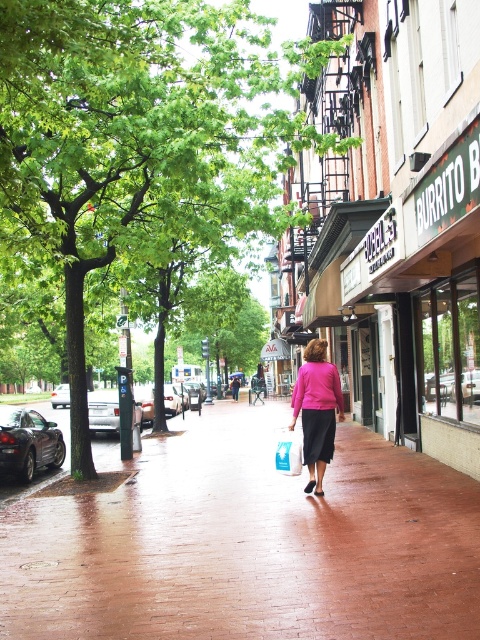
You are a delivery person trying to navigate the sidewalk in this rainy scene. The green leafy tree at center is located at coordinates 0.214, 0.298. If you need to avoid the tree, which direction should you move relative to the tree?

The green leafy tree at center is located at coordinates (143, 136). To avoid it, you should move either to the left or right of the tree depending on your current position relative to its coordinates.

You are a delivery person trying to avoid getting wet in the rain. You see the red brick sidewalk at center and the green leafy tree at center. Which one should you stand under to stay dry?

The green leafy tree at center is above the red brick sidewalk at center, so standing under the green leafy tree at center would provide shelter from the rain.

You are a delivery person trying to walk through the street while avoiding getting your packages wet. You see the red brick sidewalk at center and the pink matte skirt at center. Which path has more space to carry your packages comfortably?

The red brick sidewalk at center has a larger width than the pink matte skirt at center, so it provides more space to carry packages comfortably.